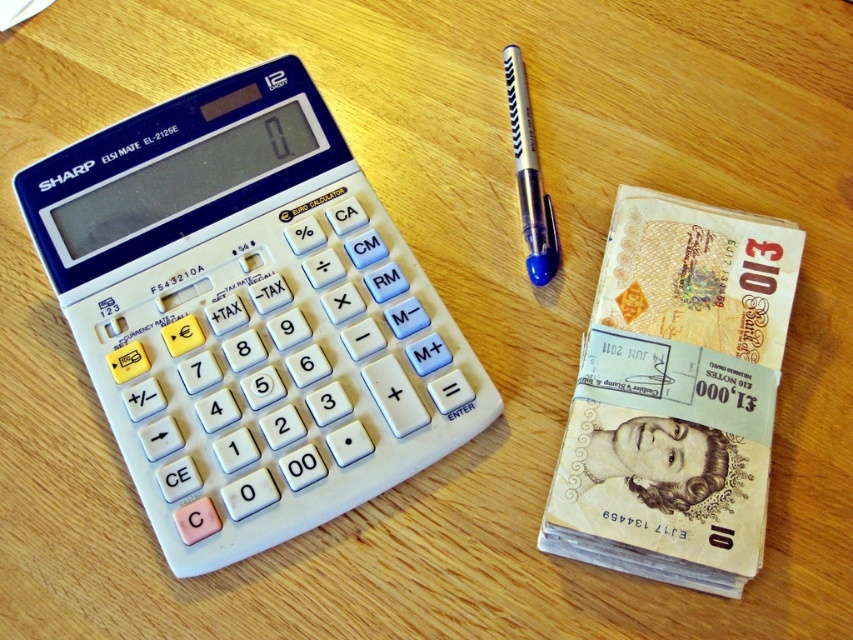
Question: Which is farther from the metallic silver pen at center-right?

Choices:
 (A) light brown paper money at right
 (B) white plastic calculator at left

Answer: (B)

Question: Which object is positioned closest to the light brown paper money at right?

Choices:
 (A) metallic silver pen at center-right
 (B) white plastic calculator at left

Answer: (A)

Question: From the image, what is the correct spatial relationship of light brown paper money at right in relation to metallic silver pen at center-right?

Choices:
 (A) right
 (B) left

Answer: (A)

Question: In this image, where is light brown paper money at right located relative to metallic silver pen at center-right?

Choices:
 (A) below
 (B) above

Answer: (A)

Question: Which point is farther to the camera?

Choices:
 (A) (178, 401)
 (B) (651, 413)
 (C) (525, 262)

Answer: (C)

Question: Does white plastic calculator at left appear on the left side of metallic silver pen at center-right?

Choices:
 (A) yes
 (B) no

Answer: (A)